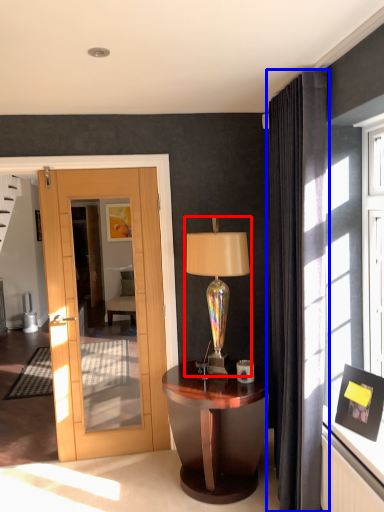
Question: Among these objects, which one is nearest to the camera, table lamp (highlighted by a red box) or curtain (highlighted by a blue box)?

Choices:
 (A) table lamp
 (B) curtain

Answer: (B)